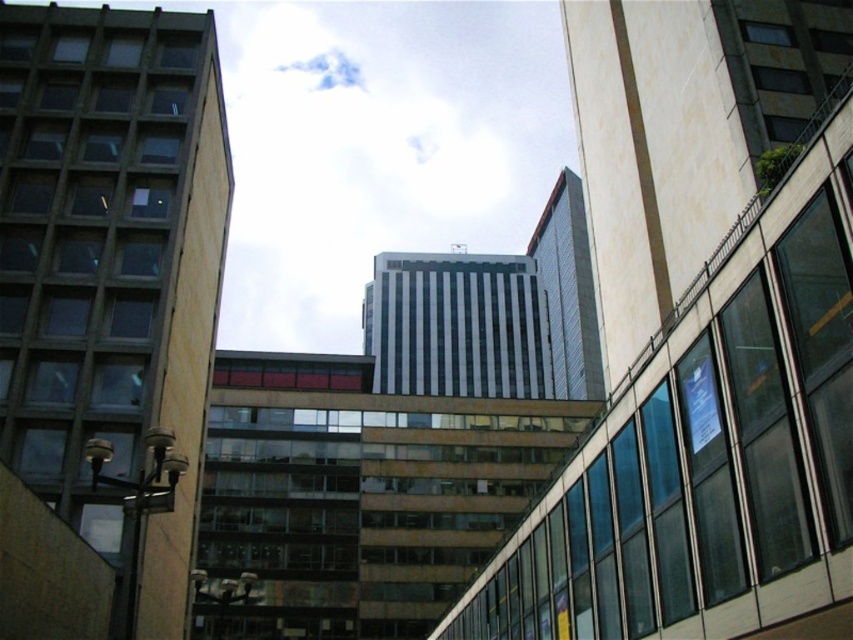
You are standing at the center of the city and want to locate the glassy reflective building at center. According to the coordinates provided, where exactly is it positioned?

The glassy reflective building at center is located at point 0.528 on the x axis and 0.823 on the y axis.

In the scene shown: You are an urban planner assessing the city layout. You need to determine if the glassy reflective building at center can be seen in full from the street adjacent to the matte concrete building at left. Based on their widths, can you confirm this?

The glassy reflective building at center is wider than the matte concrete building at left, so yes, the glassy reflective building at center can be seen in full from the street adjacent to the matte concrete building at left because its width surpasses the matte concrete building at left.

You are standing in the cityscape scene and want to determine the relative positions of two points marked in the image. Which point, point at coordinate (801, 560) or point at coordinate (28, 458), is closer to you?

Point at coordinate (801, 560) is closer to the viewer than point at coordinate (28, 458).